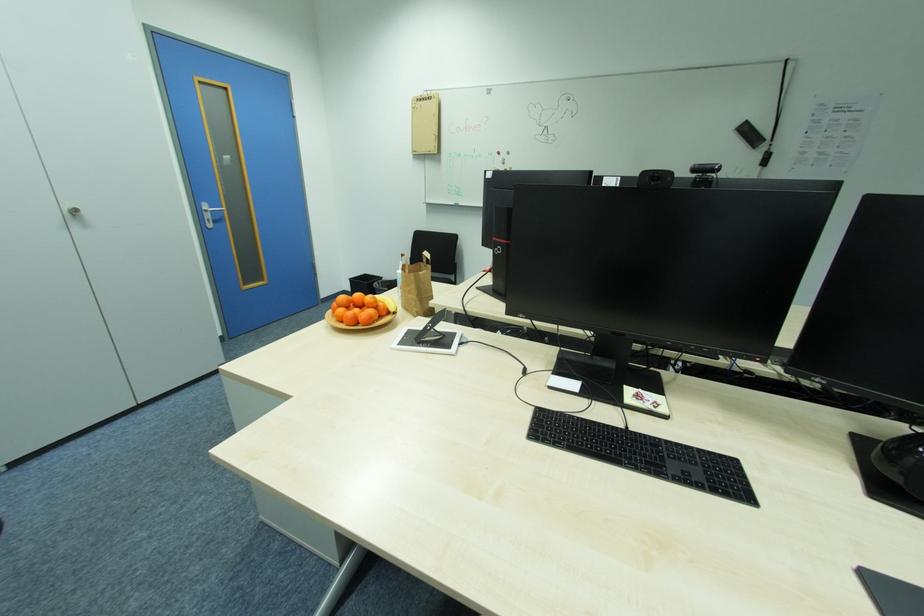
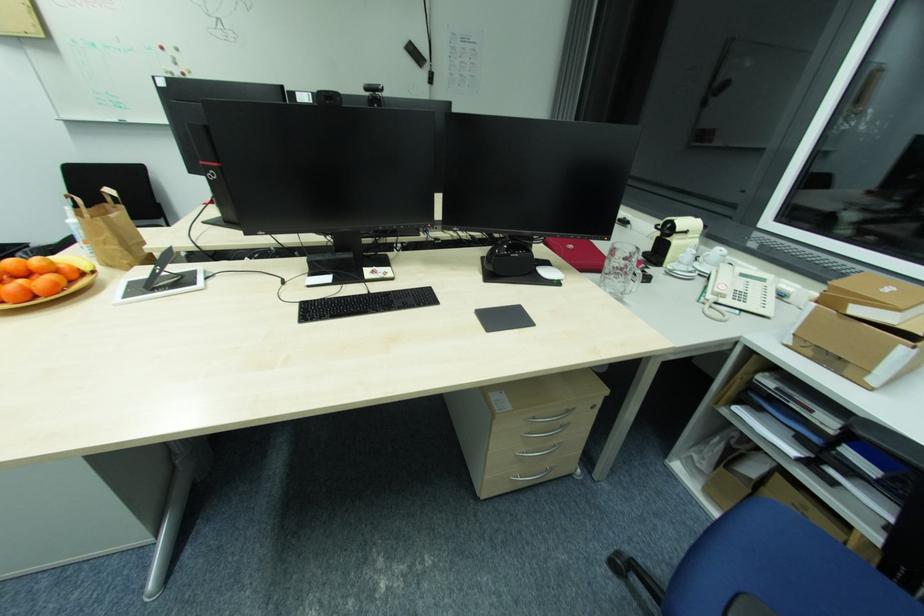
How did the camera likely rotate?

The camera rotated toward right-down.